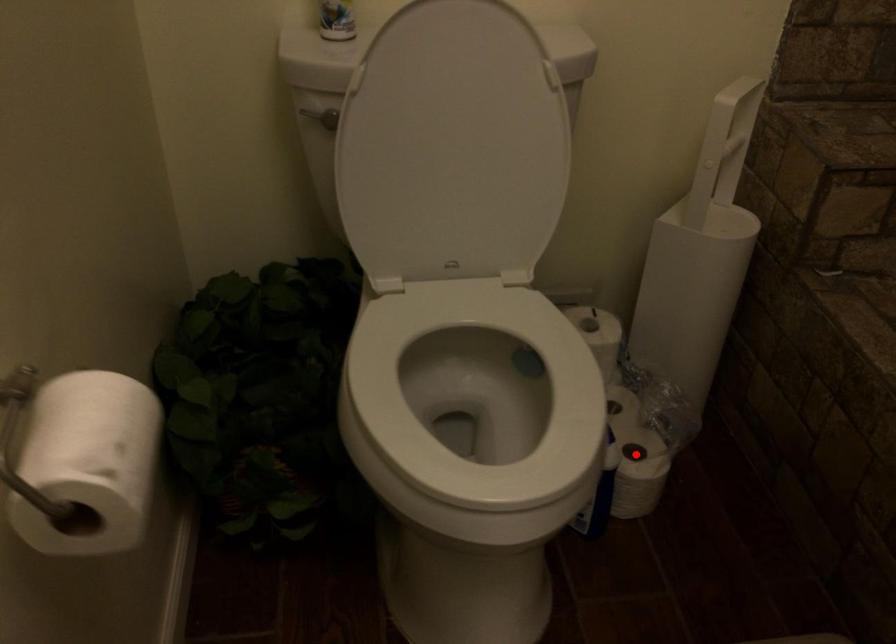
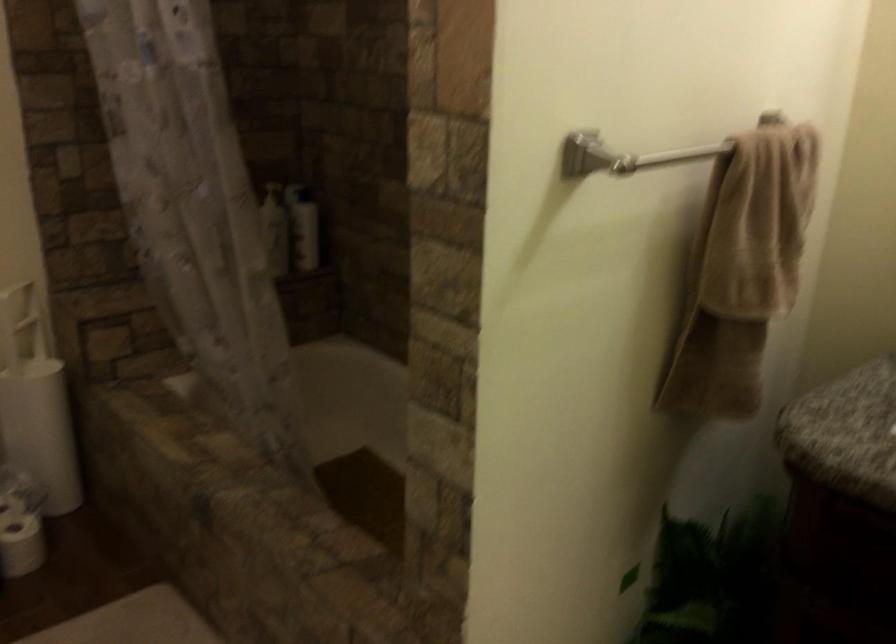
The point at the highlighted location is marked in the first image. Where is the corresponding point in the second image?

(20, 524)